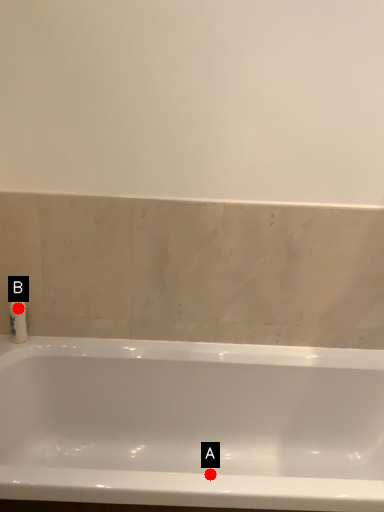
Question: Two points are circled on the image, labeled by A and B beside each circle. Which point appears closest to the camera in this image?

Choices:
 (A) A is closer
 (B) B is closer

Answer: (A)